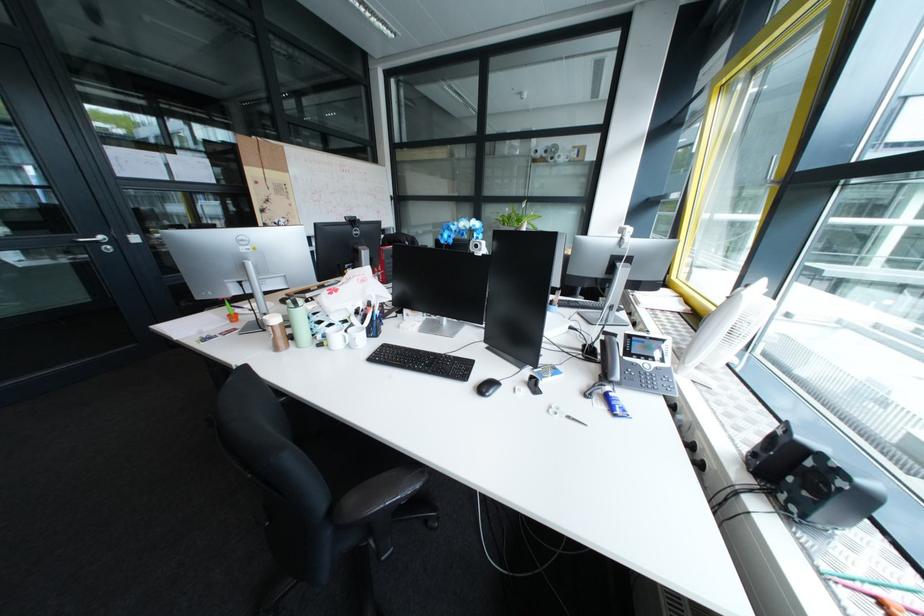
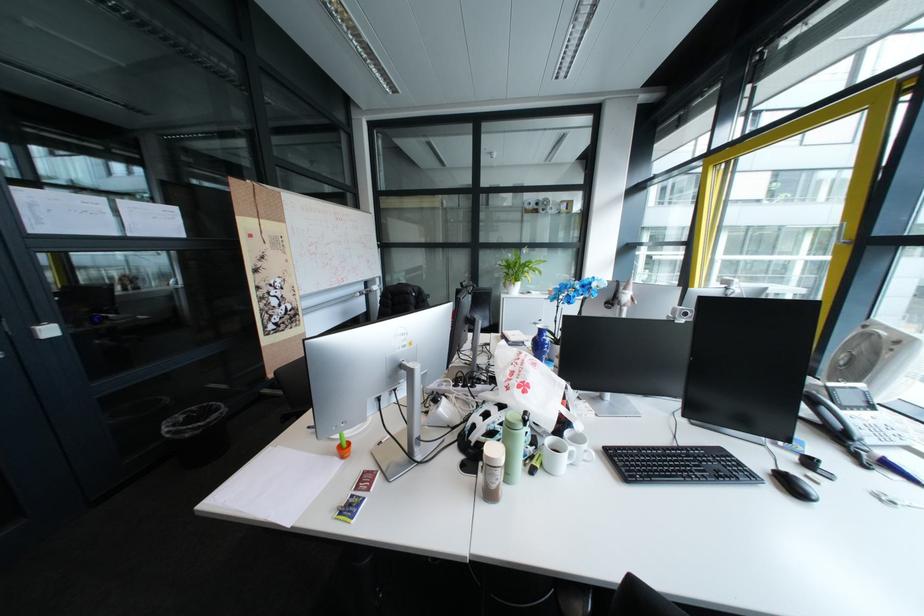
In the second image, find the point that corresponds to (284,338) in the first image.

(507, 484)